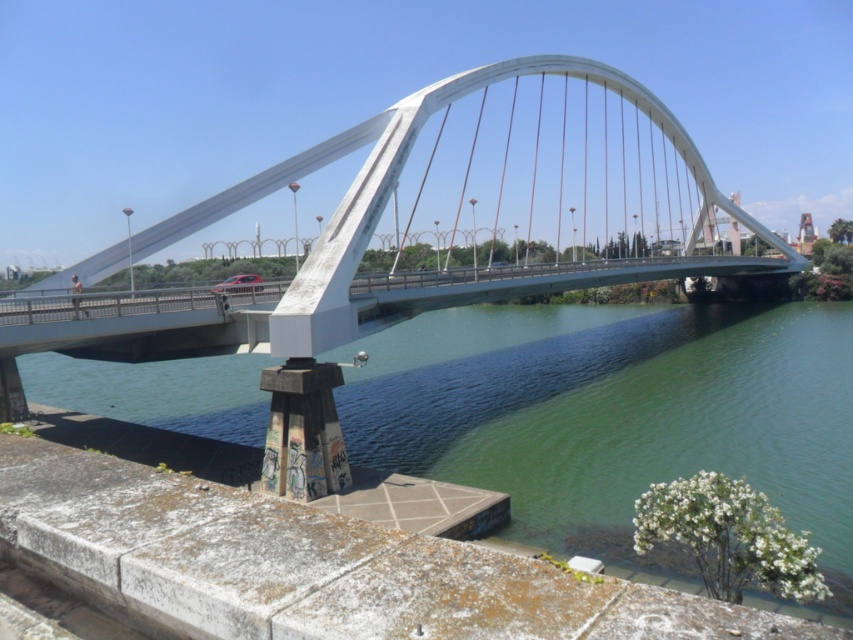
Question: Which object is closer to the camera taking this photo?

Choices:
 (A) white metallic arch bridge at center
 (B) green concrete river at lower center

Answer: (B)

Question: Among these objects, which one is farthest from the camera?

Choices:
 (A) white metallic arch bridge at center
 (B) green concrete river at lower center

Answer: (A)

Question: Where is green concrete river at lower center located in relation to white metallic arch bridge at center in the image?

Choices:
 (A) left
 (B) right

Answer: (A)

Question: Is green concrete river at lower center to the left of white metallic arch bridge at center from the viewer's perspective?

Choices:
 (A) no
 (B) yes

Answer: (B)

Question: Does green concrete river at lower center have a lesser width compared to white metallic arch bridge at center?

Choices:
 (A) yes
 (B) no

Answer: (B)

Question: Which object appears closest to the camera in this image?

Choices:
 (A) white metallic arch bridge at center
 (B) green concrete river at lower center

Answer: (B)